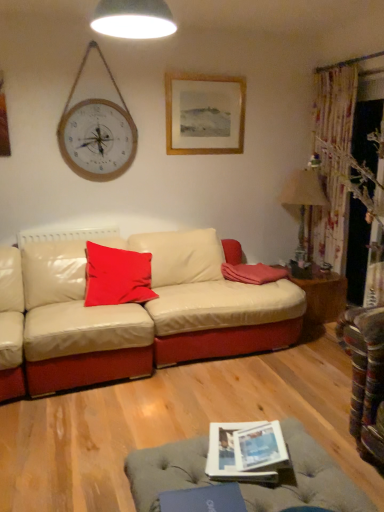
Question: In which direction should I rotate to look at soft pink fabric pillow at center, positioned as the first pillow in right-to-left order?

Choices:
 (A) left
 (B) right

Answer: (B)

Question: Which direction should I rotate to look at white glossy lampshade at upper center, the second lamp from the bottom?

Choices:
 (A) left
 (B) right

Answer: (A)

Question: Does soft pink fabric pillow at center, positioned as the first pillow in right-to-left order, turn towards white glossy lampshade at upper center, placed as the 2th lamp when sorted from right to left?

Choices:
 (A) yes
 (B) no

Answer: (B)

Question: From the image's perspective, is soft pink fabric pillow at center, the second pillow positioned from the left, on white glossy lampshade at upper center, the second lamp from the bottom?

Choices:
 (A) no
 (B) yes

Answer: (A)

Question: Considering the relative sizes of soft pink fabric pillow at center, positioned as the first pillow in right-to-left order, and white glossy lampshade at upper center, placed as the 1th lamp when sorted from front to back, in the image provided, is soft pink fabric pillow at center, positioned as the first pillow in right-to-left order, wider than white glossy lampshade at upper center, placed as the 1th lamp when sorted from front to back,?

Choices:
 (A) yes
 (B) no

Answer: (A)

Question: Is soft pink fabric pillow at center, positioned as the first pillow in right-to-left order, shorter than white glossy lampshade at upper center, the second lamp from the bottom?

Choices:
 (A) no
 (B) yes

Answer: (B)

Question: Is soft pink fabric pillow at center, the second pillow positioned from the left, positioned with its back to white glossy lampshade at upper center, placed as the 2th lamp when sorted from right to left?

Choices:
 (A) no
 (B) yes

Answer: (A)

Question: Is soft pink fabric pillow at center, the second pillow positioned from the left, smaller than white glossy lampshade at upper center, acting as the first lamp starting from the left?

Choices:
 (A) yes
 (B) no

Answer: (A)

Question: Is wooden side table at right completely or partially inside matte paper magazine at lower center?

Choices:
 (A) no
 (B) yes

Answer: (A)

Question: Is matte paper magazine at lower center to the right of wooden side table at right from the viewer's perspective?

Choices:
 (A) yes
 (B) no

Answer: (B)

Question: Is matte paper magazine at lower center at the left side of wooden side table at right?

Choices:
 (A) yes
 (B) no

Answer: (A)

Question: Does matte paper magazine at lower center have a larger size compared to wooden side table at right?

Choices:
 (A) yes
 (B) no

Answer: (B)

Question: Considering the relative sizes of matte paper magazine at lower center and wooden side table at right in the image provided, is matte paper magazine at lower center thinner than wooden side table at right?

Choices:
 (A) no
 (B) yes

Answer: (B)

Question: Is matte paper magazine at lower center far away from wooden side table at right?

Choices:
 (A) yes
 (B) no

Answer: (A)

Question: Can you confirm if matte paper magazine at lower center is positioned to the right of matte red cushion at center, which is counted as the 1th pillow, starting from the left?

Choices:
 (A) yes
 (B) no

Answer: (A)